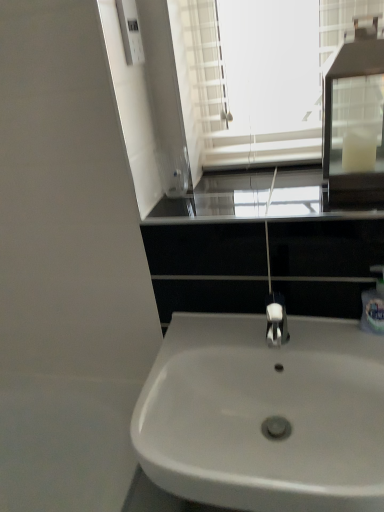
Find the location of a particular element. blank space situated above black glass window sill at center (from a real-world perspective) is located at coordinates (247, 188).